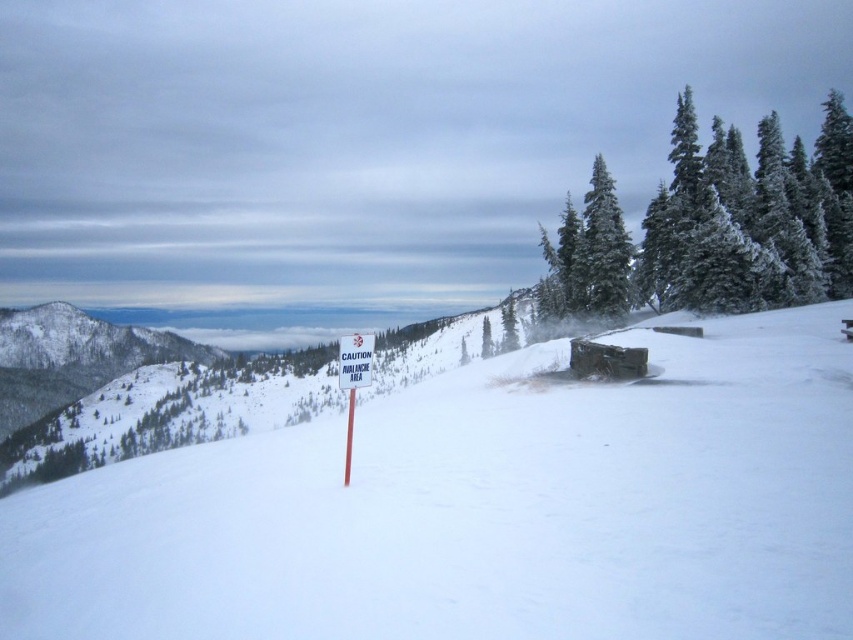
You are standing at the point with coordinates point (363, 380) and want to walk towards the signpost. Which direction should you move relative to point (236, 518)?

To reach the signpost, you should move towards point (236, 518), which is in front of point (363, 380). Since point (236, 518) is in front, you should move forward in the direction of point (236, 518) relative to your current position at point (363, 380).